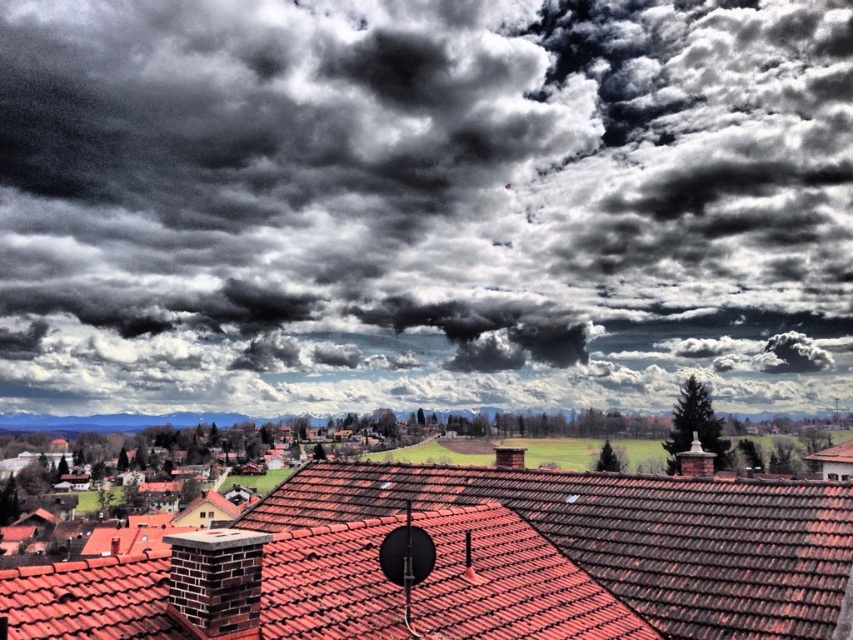
Question: Can you confirm if dark gray cloud at upper center is smaller than red clay tiles at center?

Choices:
 (A) no
 (B) yes

Answer: (A)

Question: Among these objects, which one is nearest to the camera?

Choices:
 (A) dark gray cloud at upper center
 (B) red clay tiles at center

Answer: (B)

Question: Can you confirm if dark gray cloud at upper center is positioned to the left of red clay tiles at center?

Choices:
 (A) no
 (B) yes

Answer: (B)

Question: Is dark gray cloud at upper center to the left of red clay tiles at center from the viewer's perspective?

Choices:
 (A) no
 (B) yes

Answer: (B)